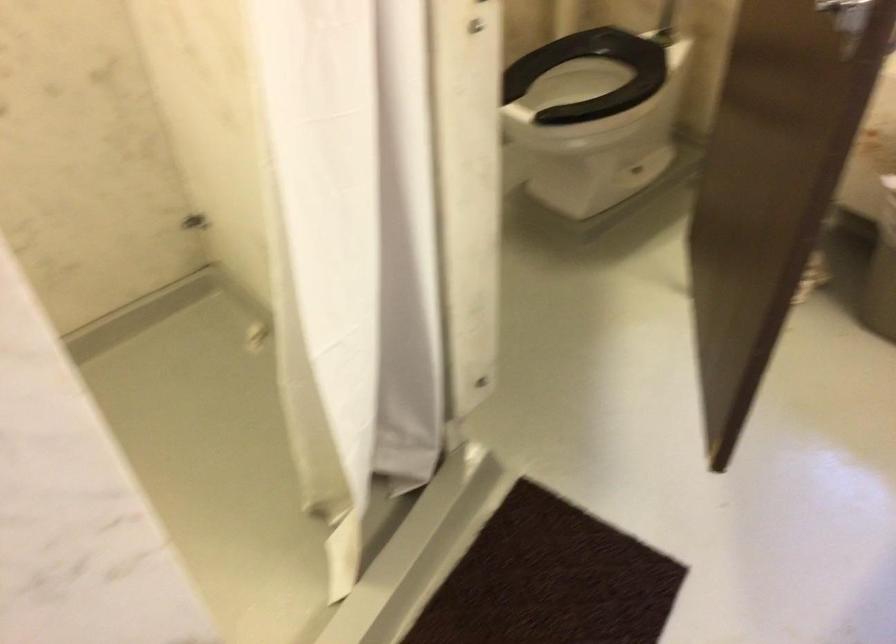
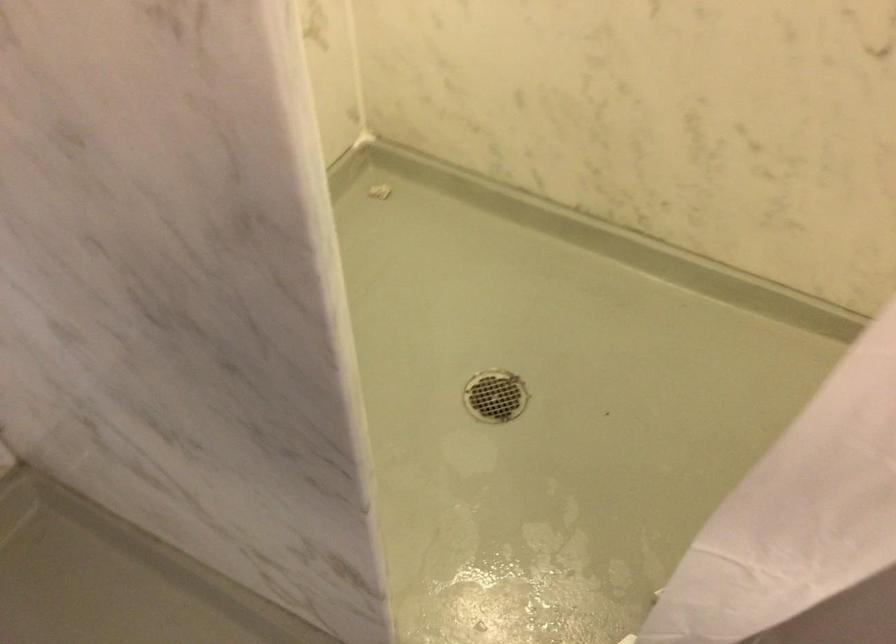
How did the camera likely rotate?

The rotation direction of the camera is left-down.